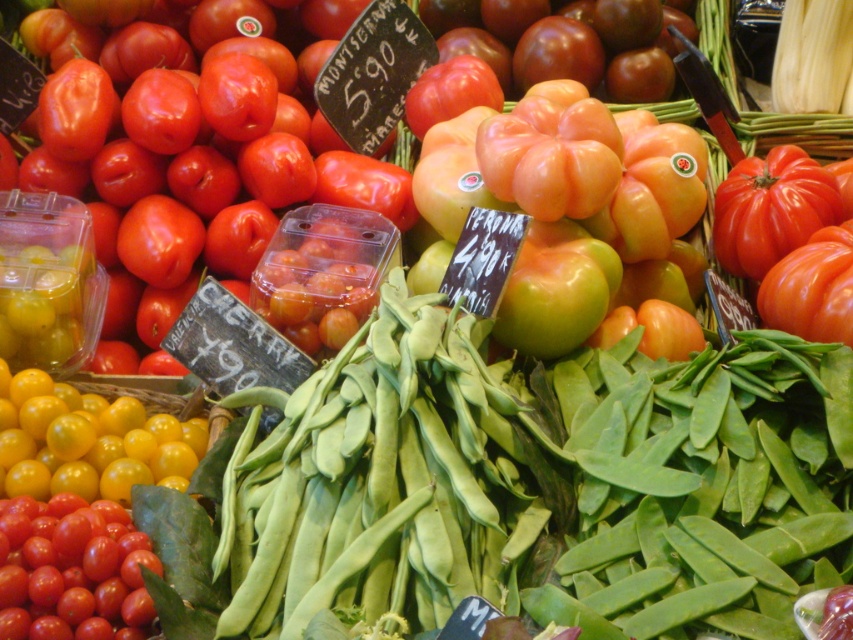
Question: Which of the following is the farthest from the observer?

Choices:
 (A) (241, 177)
 (B) (144, 561)

Answer: (A)

Question: Is orange matte tomato at center wider than shiny red cherry tomatoes at lower left?

Choices:
 (A) yes
 (B) no

Answer: (A)

Question: Which object is closer to the camera taking this photo?

Choices:
 (A) orange matte tomato at center
 (B) shiny red cherry tomatoes at lower left

Answer: (B)

Question: Does glossy cherry tomatoes at center have a greater width compared to shiny red cherry tomatoes at lower left?

Choices:
 (A) yes
 (B) no

Answer: (A)

Question: Which of the following is the closest to the observer?

Choices:
 (A) shiny red cherry tomatoes at lower left
 (B) glossy cherry tomatoes at center
 (C) orange matte tomato at center

Answer: (A)

Question: Is glossy cherry tomatoes at center to the right of orange matte tomato at center from the viewer's perspective?

Choices:
 (A) no
 (B) yes

Answer: (A)